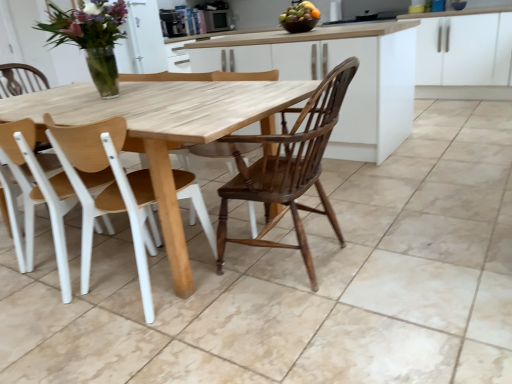
This screenshot has width=512, height=384. In order to click on vacant area situated below clear glass vase at upper left (from a real-world perspective) in this screenshot , I will do `click(101, 99)`.